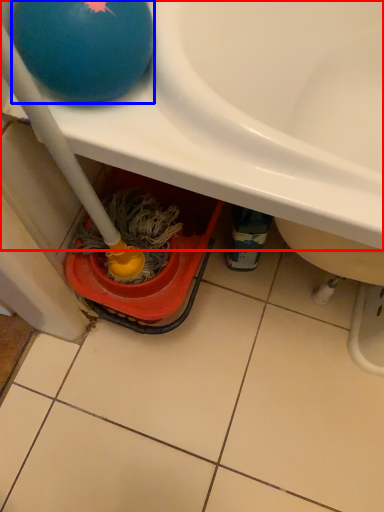
Question: Which point is closer to the camera, sink (highlighted by a red box) or ball (highlighted by a blue box)?

Choices:
 (A) sink
 (B) ball

Answer: (A)